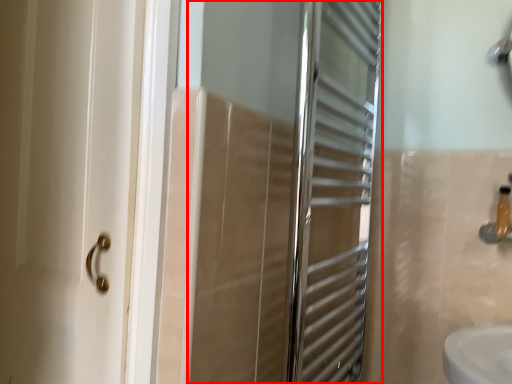
Question: From the image's perspective, what is the correct spatial relationship of screen door (annotated by the red box) in relation to toiletry?

Choices:
 (A) above
 (B) below

Answer: (A)